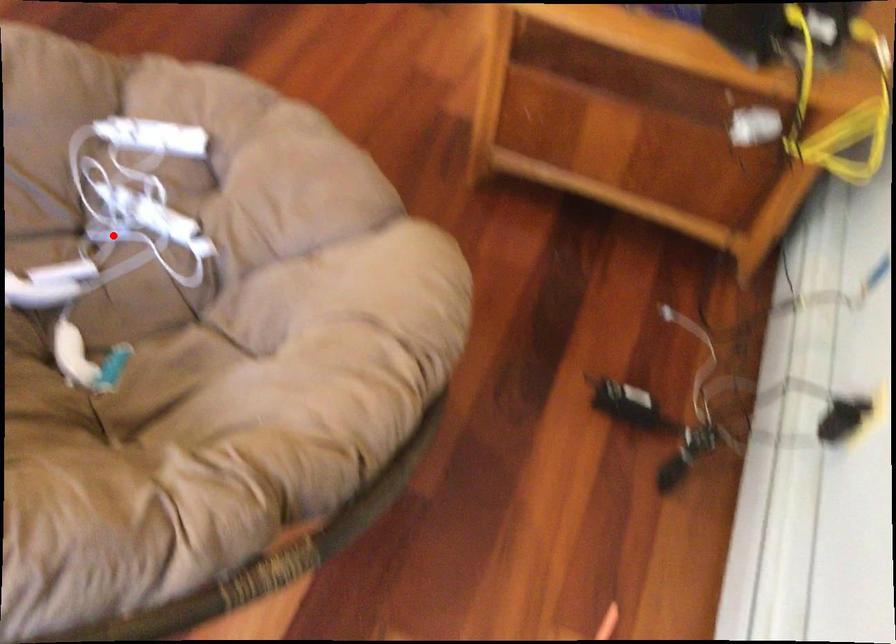
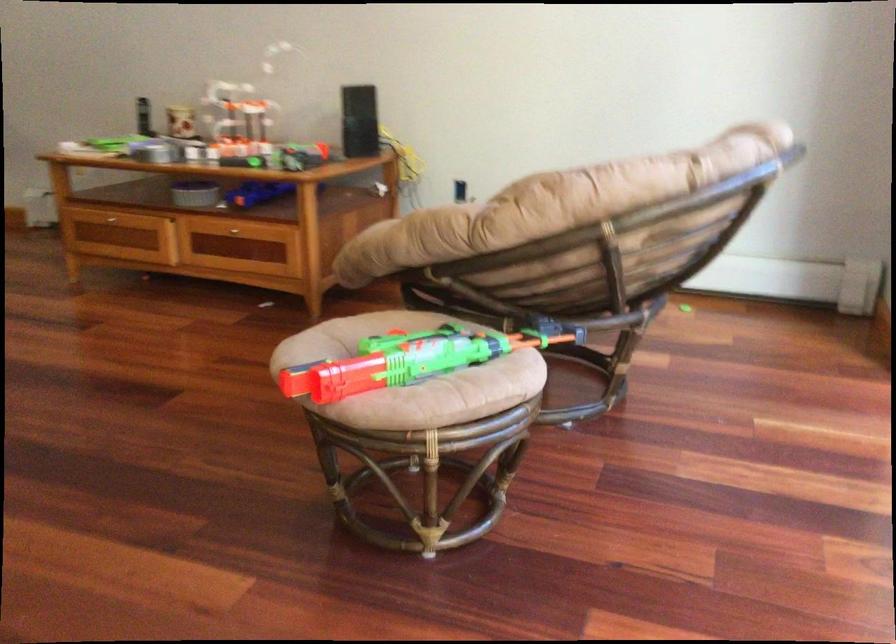
Question: I am providing you with two images of the same scene from different viewpoints. A red point is marked on the first image. Can you still see the location of the red point in image 2?

Choices:
 (A) Yes
 (B) No

Answer: (B)